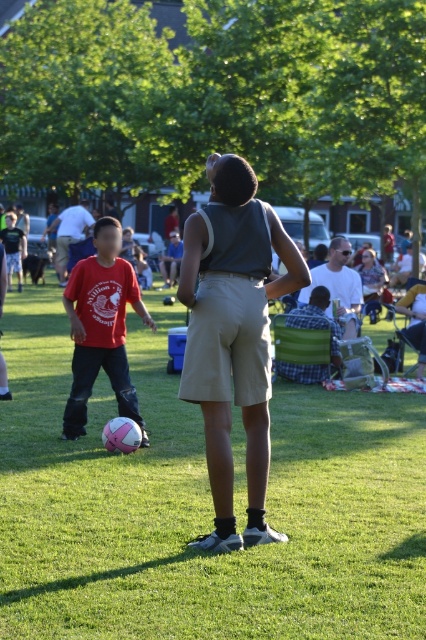
Is green grass at center smaller than matte red shirt at left?

Actually, green grass at center might be larger than matte red shirt at left.

From the picture: Is green grass at center to the right of matte red shirt at left from the viewer's perspective?

Indeed, green grass at center is positioned on the right side of matte red shirt at left.

Where is `green grass at center`? The height and width of the screenshot is (640, 426). green grass at center is located at coordinates (199, 506).

Is red cotton shirt at left above matte gray tank top at center?

Indeed, red cotton shirt at left is positioned over matte gray tank top at center.

Does point (77, 205) come in front of point (377, 289)?

No, it is behind (377, 289).

You are a GUI agent. You are given a task and a screenshot of the screen. Output one action in this format:
    pyautogui.click(x=<x>, y=<y>)
    Task: Click on the red cotton shirt at left
    The width and height of the screenshot is (426, 640).
    Given the screenshot: What is the action you would take?
    pyautogui.click(x=69, y=234)

Does green grass at center come in front of matte white shirt at center?

Yes, it is.

Which is in front, point (63, 579) or point (347, 301)?

Point (63, 579)

Is point (268, 497) closer to camera compared to point (344, 252)?

Yes, point (268, 497) is in front of point (344, 252).

Locate an element on the screen. Image resolution: width=426 pixels, height=640 pixels. green grass at center is located at coordinates (199, 506).